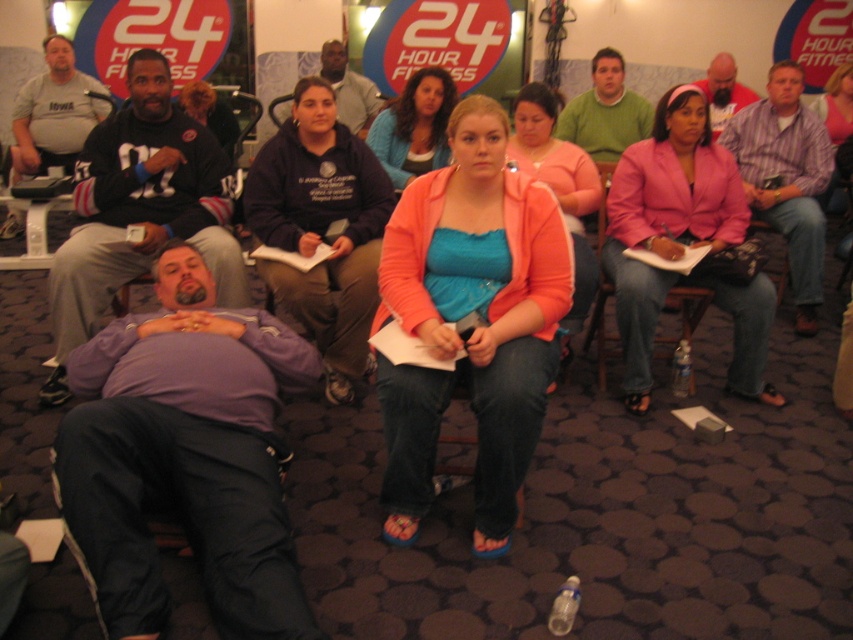
You are organizing a clothing donation drive and need to determine which items are suitable for adult sizes. You see two shirts in the center of the image, a striped cotton shirt at center and a blue fabric shirt at center. Which one is more likely to be an adult size?

The striped cotton shirt at center has a larger size compared to the blue fabric shirt at center, so it is more likely to be an adult size.

You are organizing a clothing donation drive and need to determine which shirts can fit into a donation box that has a maximum width capacity of 40 cm. The striped cotton shirt at center and the blue fabric shirt at center are both candidates. Based on their sizes, which shirt is more likely to exceed the box width limit?

The striped cotton shirt at center is more likely to exceed the box width limit because its width is larger than the blue fabric shirt at center.

In the scene shown: You are organizing a fitness class and need to arrange the pink fabric jacket at center and dark blue hoodie at center so that they are both visible to participants. Based on their current positions, which jacket should you move to the left to ensure both are visible?

The pink fabric jacket at center is currently to the right of the dark blue hoodie at center. To ensure both are visible, move the pink fabric jacket at center to the left so it is positioned next to the dark blue hoodie at center.